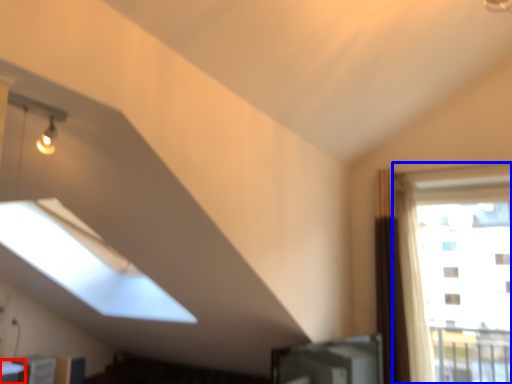
Question: Which object is closer to the camera taking this photo, table (highlighted by a red box) or window (highlighted by a blue box)?

Choices:
 (A) table
 (B) window

Answer: (A)